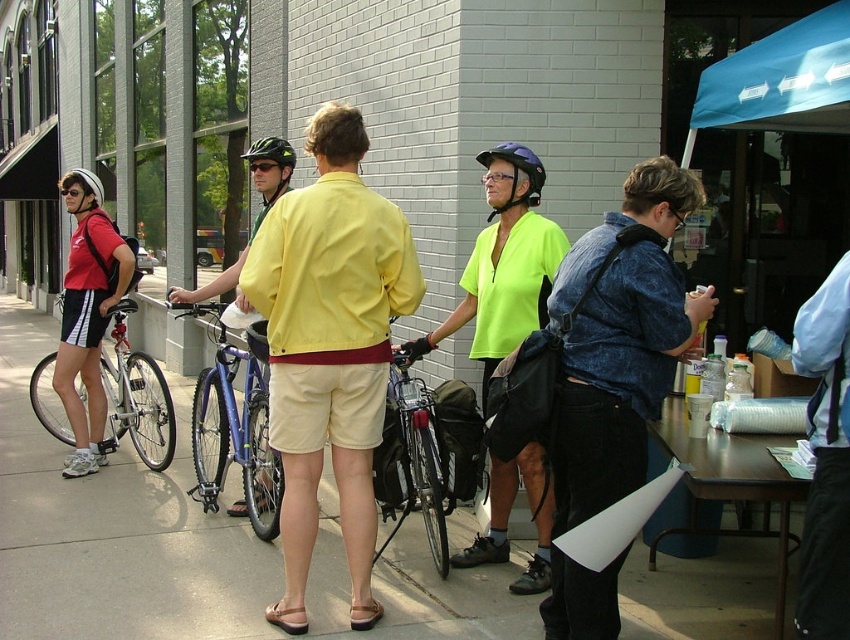
Can you confirm if matte black backpack at left is positioned below silver metallic bicycle at left?

No, matte black backpack at left is not below silver metallic bicycle at left.

Does matte black backpack at left appear over silver metallic bicycle at left?

Indeed, matte black backpack at left is positioned over silver metallic bicycle at left.

Between point (88, 220) and point (139, 445), which one is positioned behind?

The point (139, 445) is more distant.

Identify the location of matte black backpack at left. This screenshot has width=850, height=640. (88, 314).

Who is more forward, (418, 518) or (513, 141)?

Positioned in front is point (418, 518).

Does beige concrete sidewalk at center have a lesser width compared to purple matte helmet at center?

No.

Which is behind, point (54, 500) or point (513, 188)?

Positioned behind is point (54, 500).

This screenshot has height=640, width=850. Find the location of `beige concrete sidewalk at center`. beige concrete sidewalk at center is located at coordinates (112, 529).

Does denim shirt at center appear on the right side of silver metallic bicycle at left?

Yes, denim shirt at center is to the right of silver metallic bicycle at left.

Which of these two, denim shirt at center or silver metallic bicycle at left, stands shorter?

silver metallic bicycle at left is shorter.

Between point (638, 388) and point (140, 380), which one is positioned behind?

The point (140, 380) is more distant.

You are a GUI agent. You are given a task and a screenshot of the screen. Output one action in this format:
    pyautogui.click(x=<x>, y=<y>)
    Task: Click on the denim shirt at center
    The width and height of the screenshot is (850, 640).
    Given the screenshot: What is the action you would take?
    pyautogui.click(x=615, y=376)